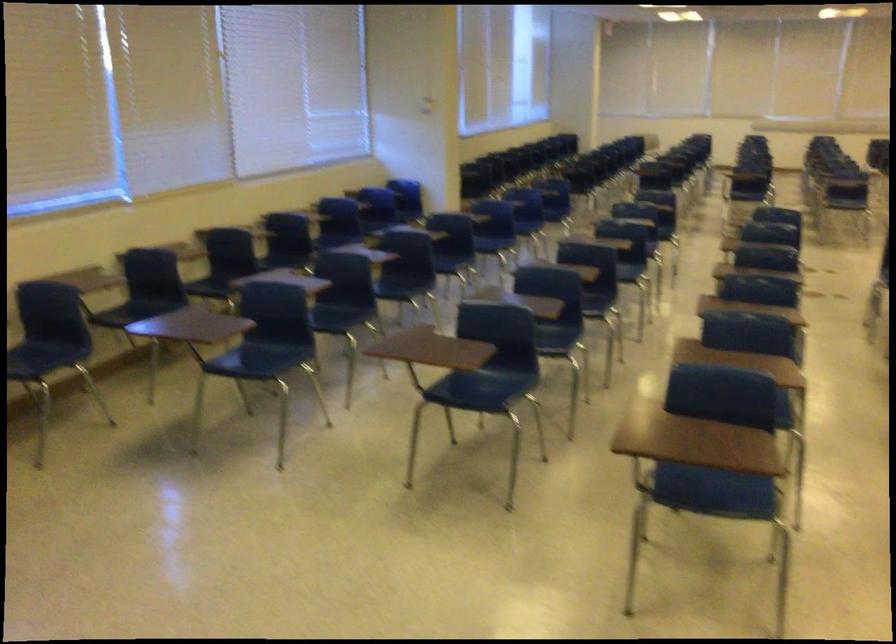
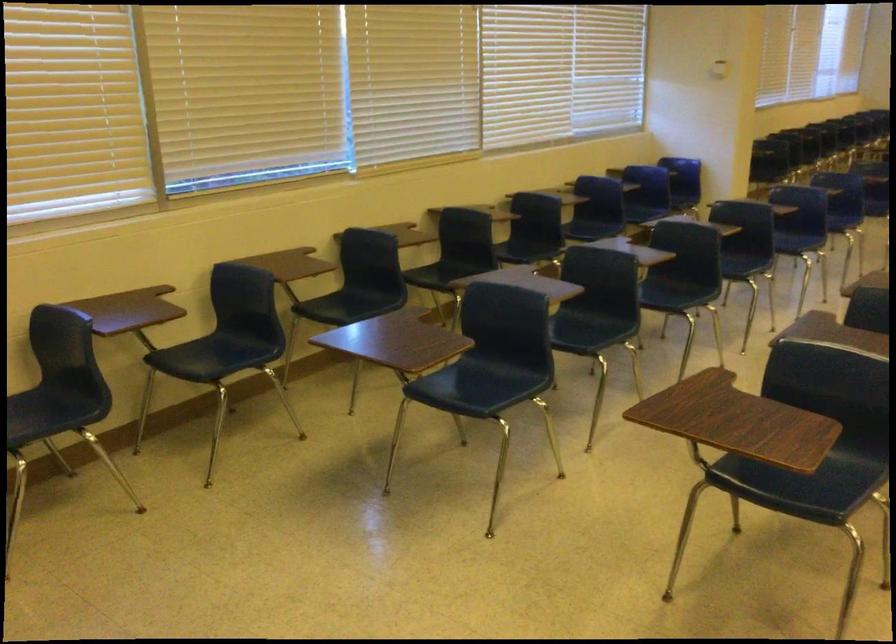
Question: The camera is either moving clockwise (left) or counter-clockwise (right) around the object. The first image is from the beginning of the video and the second image is from the end. Is the camera moving left or right when shooting the video?

Choices:
 (A) Left
 (B) Right

Answer: (B)